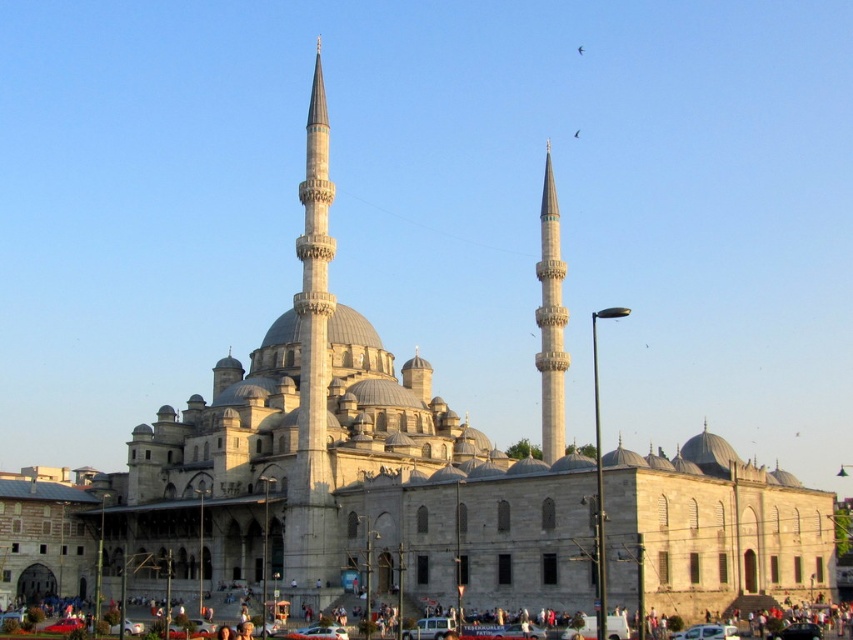
You are standing in front of the grand mosque in Istanbul. There is a gray stone minaret at center. If you look at the point marked as coordinates point (312,365), what object is located there?

The gray stone minaret at center is located at point (312,365).

You are a drone operator tasked with capturing aerial footage of the mosque. Your drone has a maximum flight range of 25 meters. If you position the drone directly above the gray stone minaret at center, can you fly it to the white stone minaret at center without exceeding the flight range?

The gray stone minaret at center and white stone minaret at center are 24.31 meters apart from each other. Since the drone has a maximum flight range of 25 meters, it can safely fly from the gray stone minaret at center to the white stone minaret at center without exceeding its limit.

You are standing in front of the mosque and want to take a photo of both the gray stone minaret at center and the white stone minaret at center. Which minaret will appear larger in the photo?

The gray stone minaret at center appears larger in the photo because it is closer to you than the white stone minaret at center.